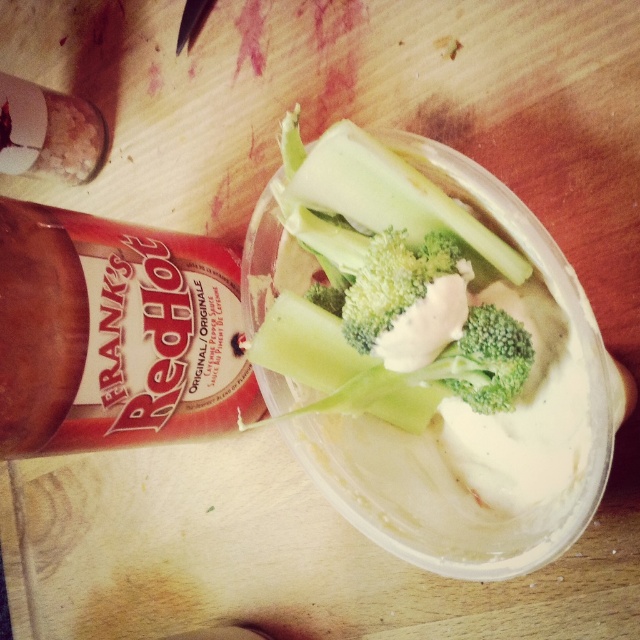
Is point (573, 378) positioned after point (36, 120)?

No, (573, 378) is closer to viewer.

Is green matte broccoli at center to the right of matte brown bottle at upper left from the viewer's perspective?

Correct, you'll find green matte broccoli at center to the right of matte brown bottle at upper left.

Locate an element on the screen. Image resolution: width=640 pixels, height=640 pixels. green matte broccoli at center is located at coordinates (420, 326).

Which is more to the left, red matte bottle at upper left or green broccoli at center?

From the viewer's perspective, red matte bottle at upper left appears more on the left side.

Is red matte bottle at upper left wider than green broccoli at center?

Yes.

Is point (38, 310) less distant than point (470, 388)?

Yes, it is.

Locate an element on the screen. This screenshot has width=640, height=640. red matte bottle at upper left is located at coordinates (115, 333).

Is matte brown bottle at upper left further to the viewer compared to green broccoli at center?

Yes, matte brown bottle at upper left is further from the viewer.

Does point (93, 134) come farther from viewer compared to point (520, 372)?

Yes, it is.

What are the coordinates of `matte brown bottle at upper left` in the screenshot? It's located at (49, 132).

Where is `matte brown bottle at upper left`? The height and width of the screenshot is (640, 640). matte brown bottle at upper left is located at coordinates (49, 132).